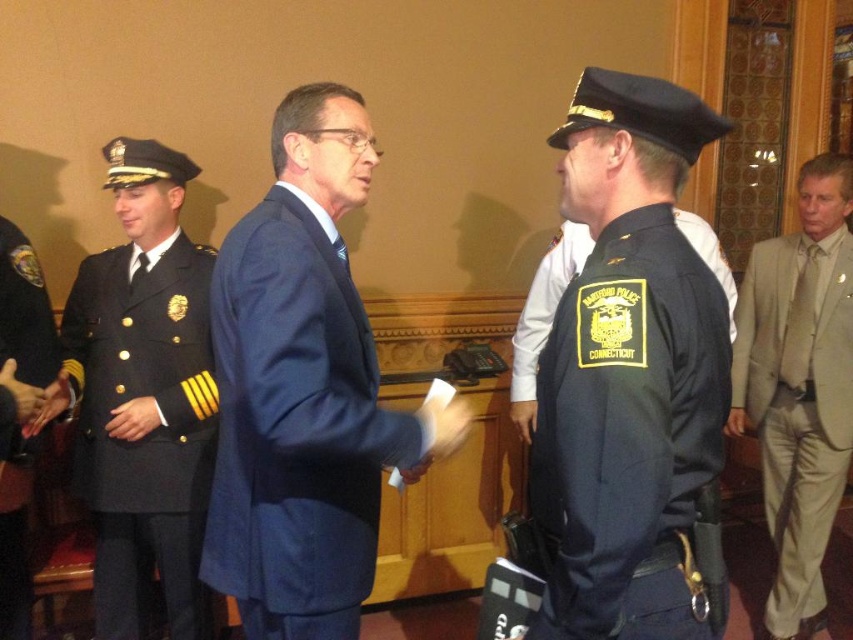
You are an architect designing a new police station and need to place two important plaques at the coordinates corresponding to point (236, 576) and point (20, 508). Which plaque should be placed closer to the entrance so it is more visible to visitors?

The plaque at point (236, 576) should be placed closer to the entrance because it is closer to the viewer than point (20, 508), making it more visible.